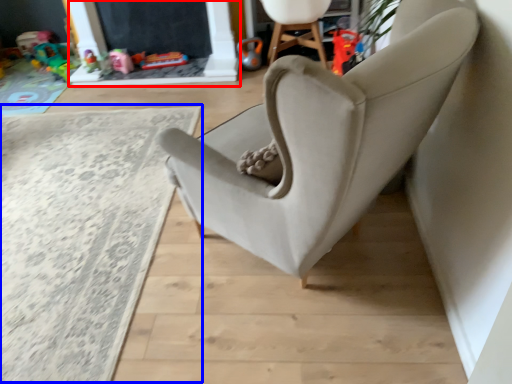
Question: Which object appears farthest to the camera in this image, fireplace (highlighted by a red box) or plain (highlighted by a blue box)?

Choices:
 (A) fireplace
 (B) plain

Answer: (A)